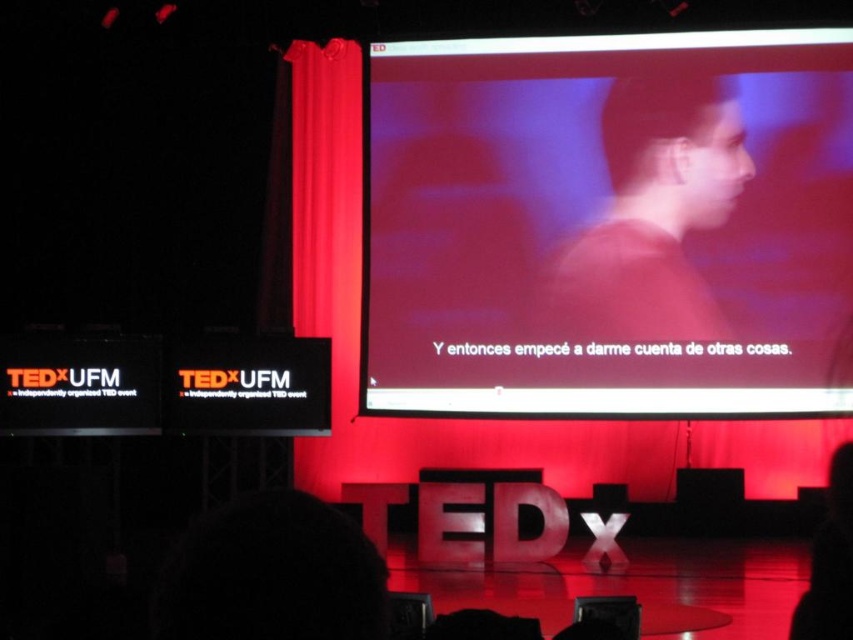
Question: Does matte screen at center come behind matte red shirt at center?

Choices:
 (A) yes
 (B) no

Answer: (B)

Question: Estimate the real-world distances between objects in this image. Which object is farther from the matte screen at center?

Choices:
 (A) dark hair at lower left
 (B) matte red shirt at center

Answer: (A)

Question: Among these points, which one is nearest to the camera?

Choices:
 (A) (637, 99)
 (B) (260, 534)

Answer: (B)

Question: Can you confirm if matte screen at center is positioned to the left of dark hair at lower left?

Choices:
 (A) no
 (B) yes

Answer: (A)

Question: Is matte red shirt at center to the right of dark hair at lower left from the viewer's perspective?

Choices:
 (A) yes
 (B) no

Answer: (A)

Question: Among these objects, which one is farthest from the camera?

Choices:
 (A) matte red shirt at center
 (B) matte screen at center
 (C) dark hair at lower left

Answer: (A)